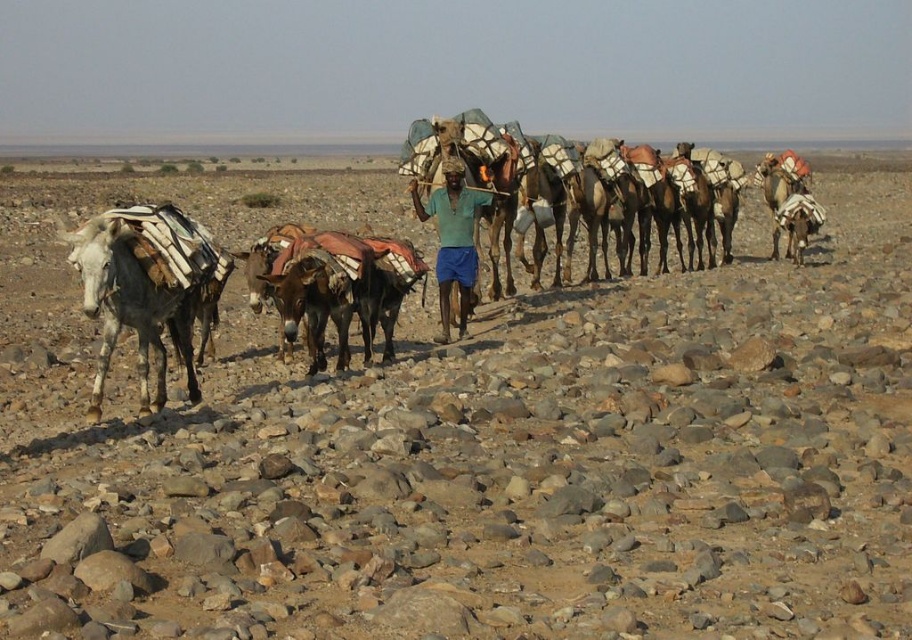
Can you confirm if green fabric shirt at center is taller than white textured blanket at right?

Indeed, green fabric shirt at center has a greater height compared to white textured blanket at right.

Is point (461, 198) farther from camera compared to point (778, 163)?

No, it is in front of (778, 163).

The width and height of the screenshot is (912, 640). I want to click on green fabric shirt at center, so click(x=453, y=240).

Who is higher up, speckled gray mule at left or white textured blanket at right?

Positioned higher is white textured blanket at right.

Is speckled gray mule at left behind white textured blanket at right?

No.

What do you see at coordinates (130, 307) in the screenshot? The image size is (912, 640). I see `speckled gray mule at left` at bounding box center [130, 307].

At what (x,y) coordinates should I click in order to perform the action: click on speckled gray mule at left. Please return your answer as a coordinate pair (x, y). The height and width of the screenshot is (640, 912). Looking at the image, I should click on [x=130, y=307].

Does speckled gray mule at left have a lesser height compared to green fabric shirt at center?

Yes, speckled gray mule at left is shorter than green fabric shirt at center.

Locate an element on the screen. speckled gray mule at left is located at coordinates (130, 307).

This screenshot has height=640, width=912. I want to click on speckled gray mule at left, so click(130, 307).